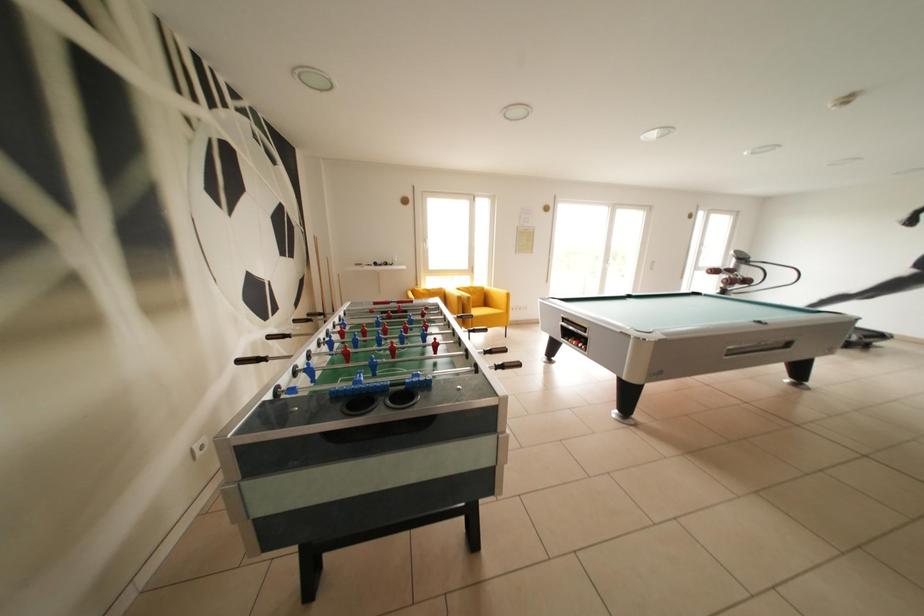
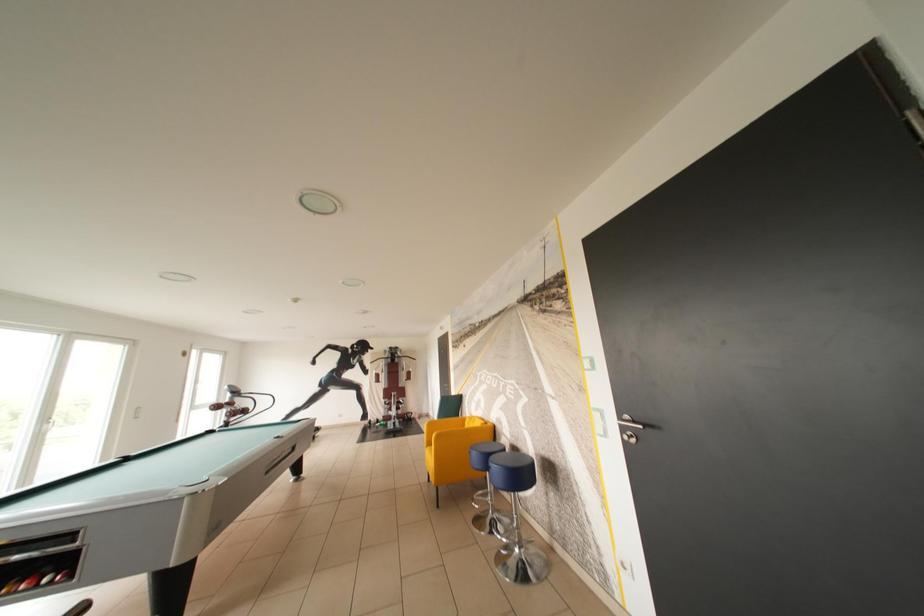
Question: The first image is from the beginning of the video and the second image is from the end. How did the camera likely rotate when shooting the video?

Choices:
 (A) Left
 (B) Right
 (C) Up
 (D) Down

Answer: (B)